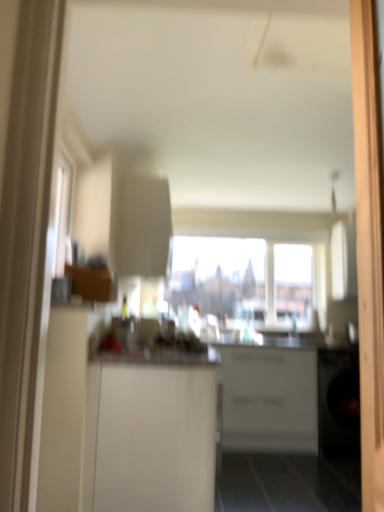
Question: Can you confirm if transparent glass window at center is positioned to the left of white matte cabinet at center, the 2th cabinetry viewed from the front?

Choices:
 (A) no
 (B) yes

Answer: (A)

Question: Is transparent glass window at center aimed at white matte cabinet at center, which is the 1th cabinetry in back-to-front order?

Choices:
 (A) no
 (B) yes

Answer: (A)

Question: From the image's perspective, is transparent glass window at center on top of white matte cabinet at center, which is the 1th cabinetry in back-to-front order?

Choices:
 (A) yes
 (B) no

Answer: (A)

Question: Is white matte cabinet at center, which is the 1th cabinetry in back-to-front order, inside transparent glass window at center?

Choices:
 (A) no
 (B) yes

Answer: (A)

Question: Can you confirm if transparent glass window at center is smaller than white matte cabinet at center, which is the 1th cabinetry in back-to-front order?

Choices:
 (A) no
 (B) yes

Answer: (B)

Question: From the image's perspective, is white glossy counter at center located above or below transparent glass window at center?

Choices:
 (A) below
 (B) above

Answer: (A)

Question: Considering their positions, is white glossy counter at center located in front of or behind transparent glass window at center?

Choices:
 (A) behind
 (B) front

Answer: (B)

Question: Is white glossy counter at center taller or shorter than transparent glass window at center?

Choices:
 (A) tall
 (B) short

Answer: (A)

Question: Considering the positions of white glossy counter at center and transparent glass window at center in the image, is white glossy counter at center wider or thinner than transparent glass window at center?

Choices:
 (A) wide
 (B) thin

Answer: (A)

Question: In terms of height, does white matte cabinet at center, the 2th cabinetry viewed from the front, look taller or shorter compared to wooden screen door at right?

Choices:
 (A) tall
 (B) short

Answer: (B)

Question: From a real-world perspective, relative to wooden screen door at right, is white matte cabinet at center, the 2th cabinetry viewed from the front, vertically above or below?

Choices:
 (A) above
 (B) below

Answer: (B)

Question: Is point (266, 365) positioned closer to the camera than point (367, 74)?

Choices:
 (A) farther
 (B) closer

Answer: (A)

Question: Do you think white matte cabinet at center, the 2th cabinetry viewed from the front, is within wooden screen door at right, or outside of it?

Choices:
 (A) outside
 (B) inside

Answer: (A)

Question: Is point (192, 260) closer or farther from the camera than point (292, 410)?

Choices:
 (A) farther
 (B) closer

Answer: (A)

Question: Would you say transparent glass window at center is to the left or to the right of white matte cabinet at center, which is the 1th cabinetry in back-to-front order, in the picture?

Choices:
 (A) left
 (B) right

Answer: (B)